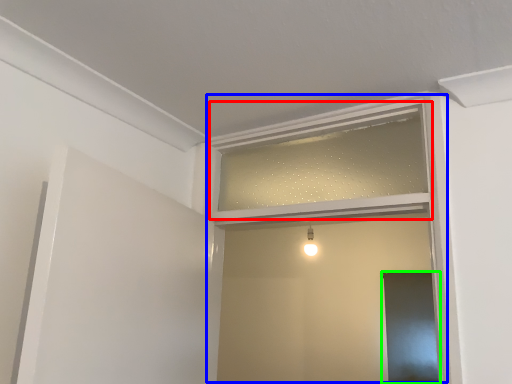
Question: Which is farther away from window frame (highlighted by a red box)? window frame (highlighted by a blue box) or screen door (highlighted by a green box)?

Choices:
 (A) window frame
 (B) screen door

Answer: (B)